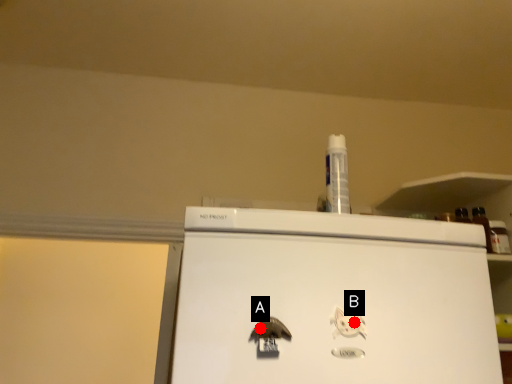
Question: Two points are circled on the image, labeled by A and B beside each circle. Which point is closer to the camera?

Choices:
 (A) A is closer
 (B) B is closer

Answer: (A)